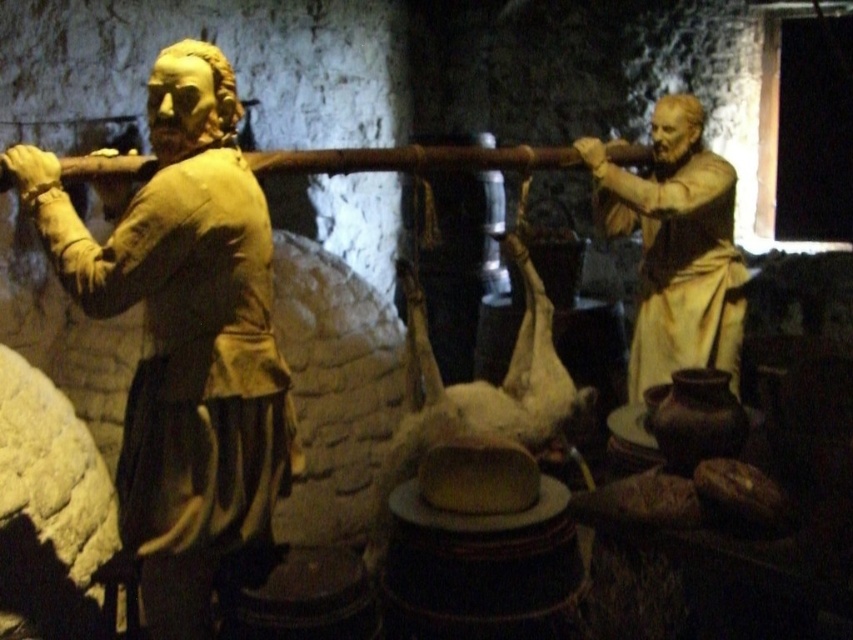
You are an art conservator examining two matte gold statues in a dimly lit historical setting. You notice the matte gold statue at left and the matte gold statue at right. Which statue is located to the left of the other?

The matte gold statue at left is positioned on the left side of the matte gold statue at right, so it is located to the left of the other.

You are a visitor in this historical setting and want to take a photo of the matte gold statue at left without including the two figures holding the long wooden pole. Is the statue positioned in a way that allows you to frame it without the figures in the shot?

The matte gold statue at left is located at point [183,336], which is to the left side of the scene. Since the two figures are centrally positioned, you can frame the statue by focusing on the left area, avoiding the central figures holding the long wooden pole.